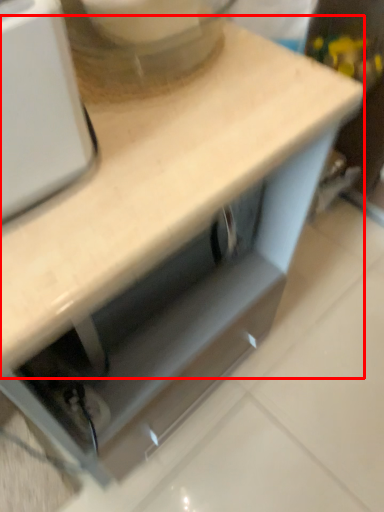
Question: From the image's perspective, what is the correct spatial relationship of countertop (annotated by the red box) in relation to mixer?

Choices:
 (A) below
 (B) above

Answer: (A)